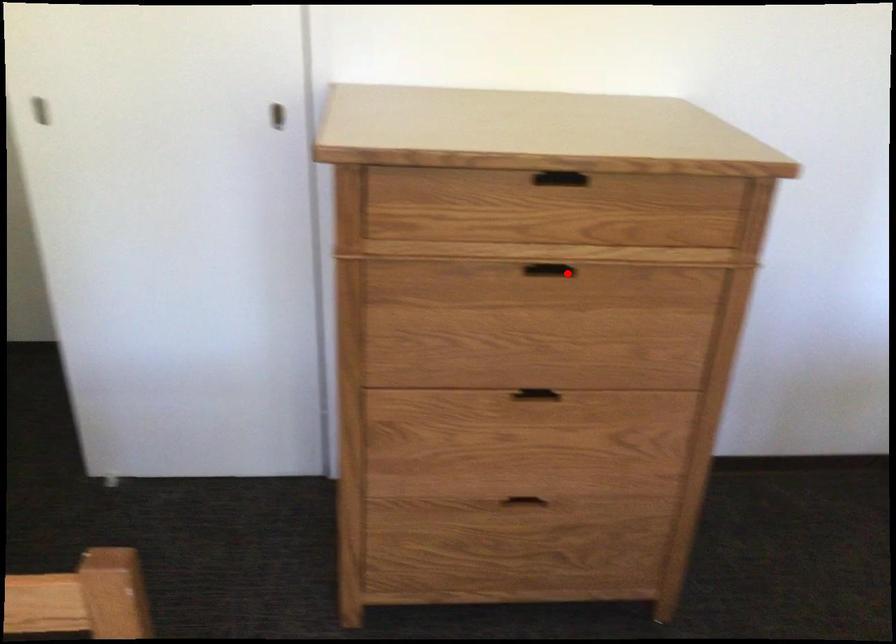
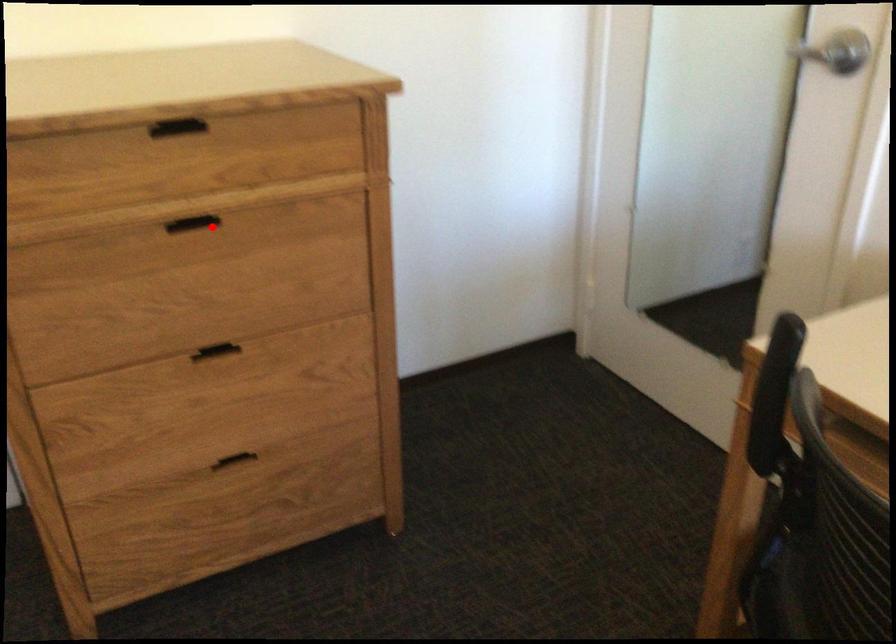
I am providing you with two images of the same scene from different viewpoints. A red point is marked on the first image and another point is marked on the second image. Is the marked point in image1 the same physical position as the marked point in image2?

Yes